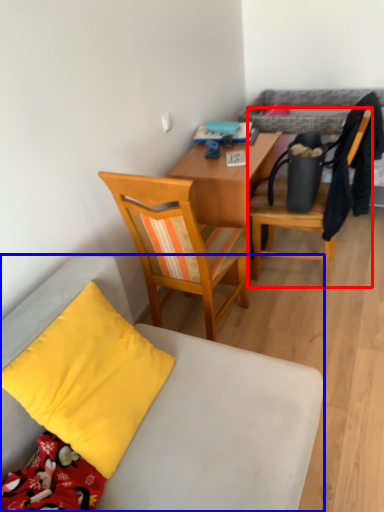
Question: Which object is closer to the camera taking this photo, chair (highlighted by a red box) or chair (highlighted by a blue box)?

Choices:
 (A) chair
 (B) chair

Answer: (B)